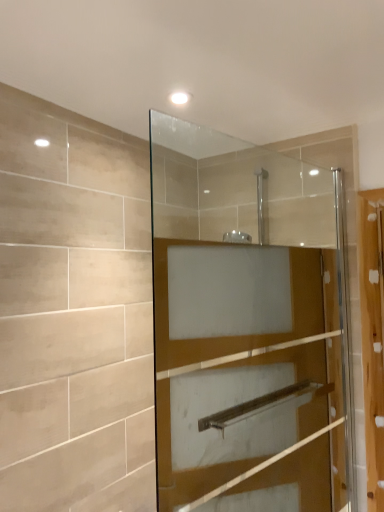
What do you see at coordinates (247, 326) in the screenshot? I see `clear glass shower door at center` at bounding box center [247, 326].

This screenshot has width=384, height=512. Find the location of `clear glass shower door at center`. clear glass shower door at center is located at coordinates (247, 326).

Consider the image. In order to face wooden screen door at right, should I rotate leftwards or rightwards?

A 25.147 degree turn to the right will do.

At what (x,y) coordinates should I click in order to perform the action: click on wooden screen door at right. Please return your answer as a coordinate pair (x, y). Looking at the image, I should click on (372, 337).

Measure the distance between wooden screen door at right and camera.

A distance of 5.08 feet exists between wooden screen door at right and camera.

Describe the element at coordinates (372, 337) in the screenshot. I see `wooden screen door at right` at that location.

Image resolution: width=384 pixels, height=512 pixels. What are the coordinates of `clear glass shower door at center` in the screenshot? It's located at (247, 326).

Can you confirm if wooden screen door at right is positioned to the right of clear glass shower door at center?

Yes, wooden screen door at right is to the right of clear glass shower door at center.

Between wooden screen door at right and clear glass shower door at center, which one is positioned in front?

Positioned in front is clear glass shower door at center.

Does point (380, 509) come behind point (167, 362)?

That is True.

From the image's perspective, is wooden screen door at right beneath clear glass shower door at center?

Yes.

From a real-world perspective, does wooden screen door at right sit lower than clear glass shower door at center?

Yes, from a real-world perspective, wooden screen door at right is under clear glass shower door at center.

Which of these two, wooden screen door at right or clear glass shower door at center, is wider?

wooden screen door at right.

Between wooden screen door at right and clear glass shower door at center, which one has more height?

Standing taller between the two is clear glass shower door at center.

From the picture: Is wooden screen door at right smaller than clear glass shower door at center?

Yes.

Is wooden screen door at right outside of clear glass shower door at center?

Yes.

Is wooden screen door at right in contact with clear glass shower door at center?

No, wooden screen door at right is not making contact with clear glass shower door at center.

Is wooden screen door at right oriented away from clear glass shower door at center?

That's right, wooden screen door at right is facing away from clear glass shower door at center.

How many degrees apart are the facing directions of wooden screen door at right and clear glass shower door at center?

27.4 degrees.

At what (x,y) coordinates should I click in order to perform the action: click on door that appears in front of the wooden screen door at right. Please return your answer as a coordinate pair (x, y). The width and height of the screenshot is (384, 512). Looking at the image, I should click on (247, 326).

Would you say clear glass shower door at center is to the left or to the right of wooden screen door at right in the picture?

In the image, clear glass shower door at center appears on the left side of wooden screen door at right.

Between clear glass shower door at center and wooden screen door at right, which one is positioned behind?

wooden screen door at right.

Is point (303, 197) farther from camera compared to point (370, 207)?

Yes, point (303, 197) is farther from viewer.

From the image's perspective, which one is positioned lower, clear glass shower door at center or wooden screen door at right?

wooden screen door at right is shown below in the image.

From a real-world perspective, is clear glass shower door at center physically below wooden screen door at right?

No, from a real-world perspective, clear glass shower door at center is not below wooden screen door at right.

Does clear glass shower door at center have a greater width compared to wooden screen door at right?

No, clear glass shower door at center is not wider than wooden screen door at right.

Is clear glass shower door at center taller or shorter than wooden screen door at right?

Clearly, clear glass shower door at center is taller compared to wooden screen door at right.

Is clear glass shower door at center bigger than wooden screen door at right?

Indeed, clear glass shower door at center has a larger size compared to wooden screen door at right.

Is clear glass shower door at center surrounding wooden screen door at right?

No, wooden screen door at right is not surrounded by clear glass shower door at center.

Does clear glass shower door at center touch wooden screen door at right?

No, clear glass shower door at center is not making contact with wooden screen door at right.

Does clear glass shower door at center turn towards wooden screen door at right?

Yes, clear glass shower door at center is turned towards wooden screen door at right.

From the picture: How many degrees apart are the facing directions of clear glass shower door at center and wooden screen door at right?

clear glass shower door at center and wooden screen door at right are facing 27.4 degrees away from each other.

Measure the distance between clear glass shower door at center and wooden screen door at right.

clear glass shower door at center is 16.36 inches from wooden screen door at right.

The height and width of the screenshot is (512, 384). In the image, there is a clear glass shower door at center. Identify the location of screen door below it (from a real-world perspective). (372, 337).

Where is `door above the wooden screen door at right (from the image's perspective)`? door above the wooden screen door at right (from the image's perspective) is located at coordinates (247, 326).

Find the location of a particular element. The height and width of the screenshot is (512, 384). screen door behind the clear glass shower door at center is located at coordinates (372, 337).